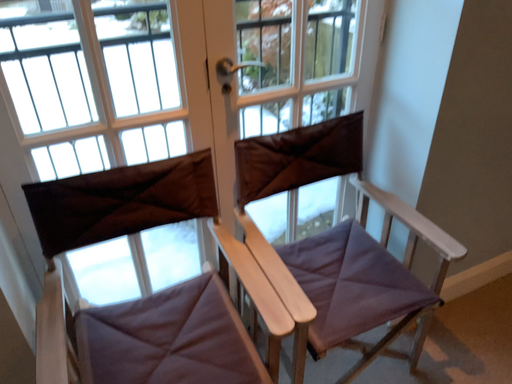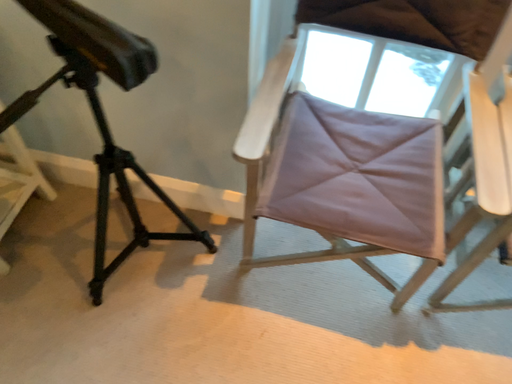
Question: How did the camera likely rotate when shooting the video?

Choices:
 (A) rotated right
 (B) rotated left

Answer: (B)